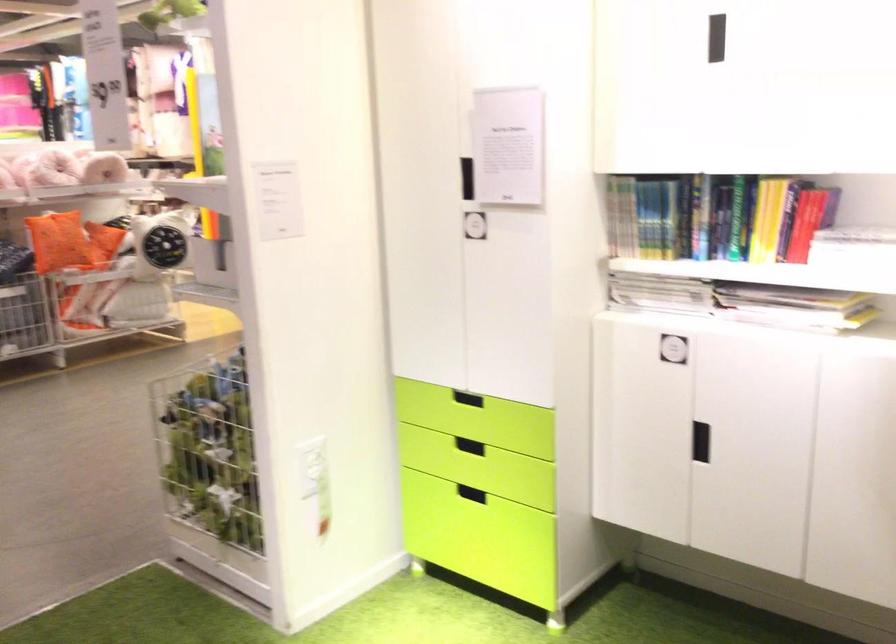
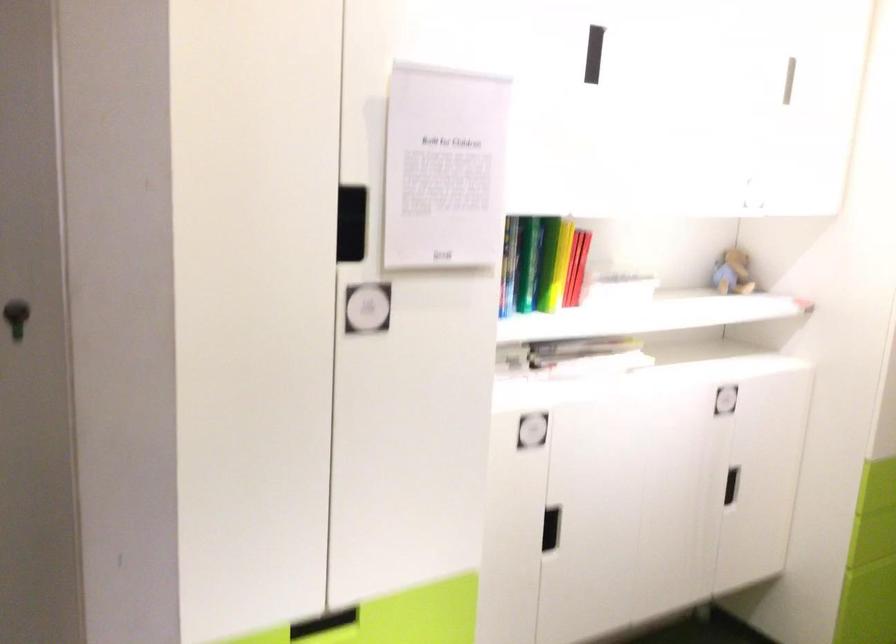
Where in the second image is the point corresponding to (746,213) from the first image?

(528, 263)